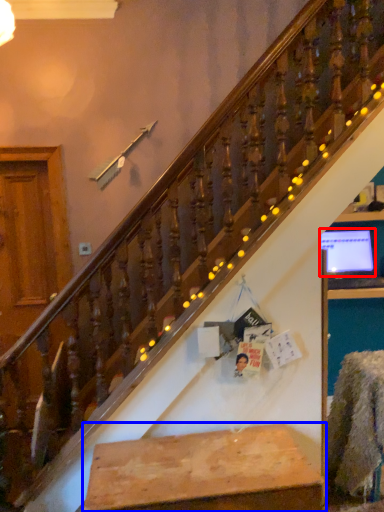
Question: Which object appears farthest to the camera in this image, computer monitor (highlighted by a red box) or furniture (highlighted by a blue box)?

Choices:
 (A) computer monitor
 (B) furniture

Answer: (A)